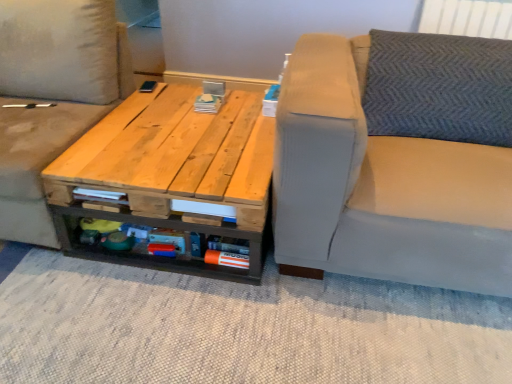
Question: Considering the relative sizes of light beige fabric studio couch at right, which appears as the second studio couch when viewed from the left, and natural wood table at center in the image provided, is light beige fabric studio couch at right, which appears as the second studio couch when viewed from the left, thinner than natural wood table at center?

Choices:
 (A) yes
 (B) no

Answer: (B)

Question: Can you see light beige fabric studio couch at right, arranged as the 1th studio couch when viewed from the right, touching natural wood table at center?

Choices:
 (A) yes
 (B) no

Answer: (B)

Question: Can you confirm if light beige fabric studio couch at right, which appears as the second studio couch when viewed from the left, is taller than natural wood table at center?

Choices:
 (A) yes
 (B) no

Answer: (A)

Question: Could natural wood table at center be considered to be inside light beige fabric studio couch at right, which appears as the second studio couch when viewed from the left?

Choices:
 (A) no
 (B) yes

Answer: (A)

Question: From the image's perspective, is light beige fabric studio couch at right, arranged as the 1th studio couch when viewed from the right, on top of natural wood table at center?

Choices:
 (A) yes
 (B) no

Answer: (A)

Question: From the image's perspective, does light beige fabric studio couch at right, arranged as the 1th studio couch when viewed from the right, appear lower than natural wood table at center?

Choices:
 (A) no
 (B) yes

Answer: (A)

Question: Is light beige fabric studio couch at right, which appears as the second studio couch when viewed from the left, further to camera compared to light beige fabric studio couch at center, which appears as the 2th studio couch when viewed from the right?

Choices:
 (A) no
 (B) yes

Answer: (A)

Question: Does light beige fabric studio couch at right, arranged as the 1th studio couch when viewed from the right, have a lesser width compared to light beige fabric studio couch at center, which is counted as the first studio couch, starting from the left?

Choices:
 (A) no
 (B) yes

Answer: (A)

Question: Is light beige fabric studio couch at right, which appears as the second studio couch when viewed from the left, positioned far away from light beige fabric studio couch at center, which is counted as the first studio couch, starting from the left?

Choices:
 (A) no
 (B) yes

Answer: (B)

Question: From the image's perspective, is light beige fabric studio couch at right, arranged as the 1th studio couch when viewed from the right, beneath light beige fabric studio couch at center, which is counted as the first studio couch, starting from the left?

Choices:
 (A) no
 (B) yes

Answer: (B)

Question: Considering the relative positions of light beige fabric studio couch at right, arranged as the 1th studio couch when viewed from the right, and light beige fabric studio couch at center, which appears as the 2th studio couch when viewed from the right, in the image provided, is light beige fabric studio couch at right, arranged as the 1th studio couch when viewed from the right, to the left of light beige fabric studio couch at center, which appears as the 2th studio couch when viewed from the right, from the viewer's perspective?

Choices:
 (A) no
 (B) yes

Answer: (A)

Question: Can you confirm if light beige fabric studio couch at right, arranged as the 1th studio couch when viewed from the right, is wider than light beige fabric studio couch at center, which appears as the 2th studio couch when viewed from the right?

Choices:
 (A) yes
 (B) no

Answer: (A)

Question: Is light beige fabric studio couch at center, which appears as the 2th studio couch when viewed from the right, to the right of light beige fabric studio couch at right, arranged as the 1th studio couch when viewed from the right, from the viewer's perspective?

Choices:
 (A) yes
 (B) no

Answer: (B)